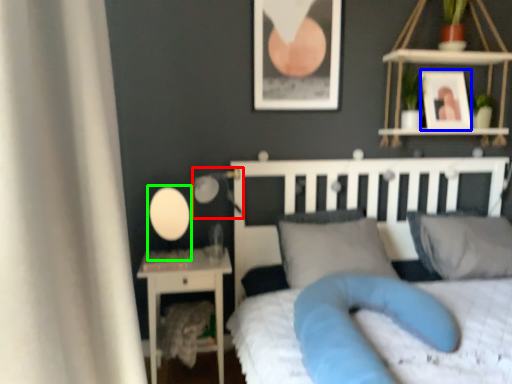
Question: Which is nearer to the table lamp (highlighted by a red box)? picture frame (highlighted by a blue box) or table lamp (highlighted by a green box).

Choices:
 (A) picture frame
 (B) table lamp

Answer: (B)